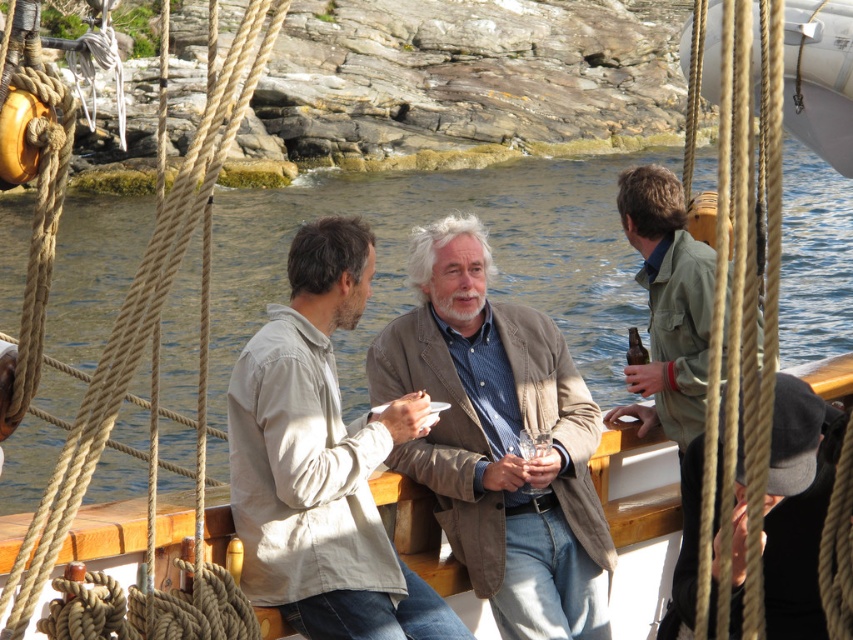
You are a photographer on the boat and want to take a photo of both the light brown cotton shirt at center and the black wool cap at lower right. Which object should you focus on first to ensure both are in the frame?

The light brown cotton shirt at center is positioned under the black wool cap at lower right, so you should focus on the light brown cotton shirt at center first to ensure both are in the frame.